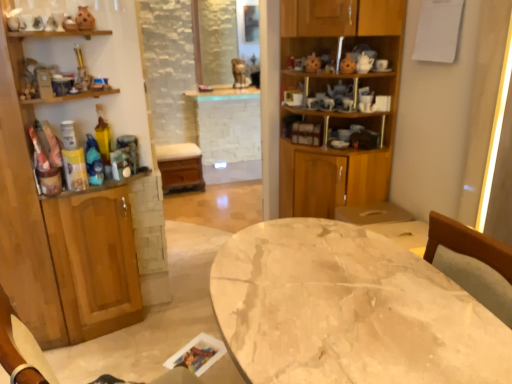
Question: Can you confirm if wooden cabinet at left, which is the 1th cabinetry in left-to-right order, is thinner than marble table at center?

Choices:
 (A) no
 (B) yes

Answer: (B)

Question: Does wooden cabinet at left, which is the 2th cabinetry from right to left, have a larger size compared to marble table at center?

Choices:
 (A) no
 (B) yes

Answer: (B)

Question: Is wooden cabinet at left, which is the 1th cabinetry in left-to-right order, outside of marble table at center?

Choices:
 (A) no
 (B) yes

Answer: (B)

Question: From the image's perspective, is wooden cabinet at left, which is the 1th cabinetry in left-to-right order, below marble table at center?

Choices:
 (A) yes
 (B) no

Answer: (B)

Question: Can you confirm if wooden cabinet at left, which is the 1th cabinetry in left-to-right order, is smaller than marble table at center?

Choices:
 (A) yes
 (B) no

Answer: (B)

Question: Is wooden cabinet at left, which is the 1th cabinetry in left-to-right order, positioned far away from marble table at center?

Choices:
 (A) no
 (B) yes

Answer: (B)

Question: Does wooden cabinet at center, the 1th cabinetry when ordered from right to left, lie behind marble table at center?

Choices:
 (A) no
 (B) yes

Answer: (B)

Question: Is wooden cabinet at center, which is counted as the second cabinetry, starting from the left, closer to the viewer compared to marble table at center?

Choices:
 (A) yes
 (B) no

Answer: (B)

Question: Is wooden cabinet at center, which is counted as the second cabinetry, starting from the left, at the left side of marble table at center?

Choices:
 (A) yes
 (B) no

Answer: (B)

Question: From the image's perspective, is wooden cabinet at center, the 1th cabinetry when ordered from right to left, on marble table at center?

Choices:
 (A) no
 (B) yes

Answer: (B)

Question: Can you confirm if wooden cabinet at center, which is counted as the second cabinetry, starting from the left, is smaller than marble table at center?

Choices:
 (A) no
 (B) yes

Answer: (A)

Question: Is wooden cabinet at center, which is counted as the second cabinetry, starting from the left, far from marble table at center?

Choices:
 (A) yes
 (B) no

Answer: (A)

Question: Can you confirm if wooden cabinet at left, which is the 2th cabinetry from right to left, is bigger than wooden cabinet at center, which is counted as the second cabinetry, starting from the left?

Choices:
 (A) no
 (B) yes

Answer: (A)